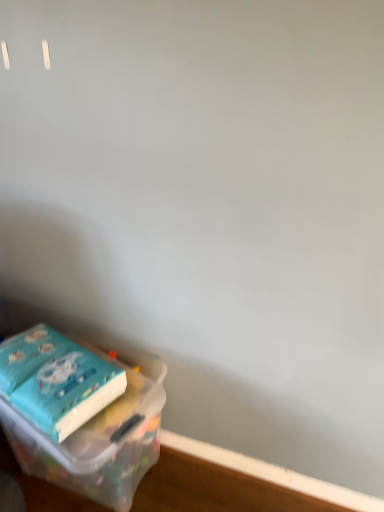
Question: Considering their positions, is translucent plastic container at lower left located in front of or behind teal matte paper at lower left?

Choices:
 (A) behind
 (B) front

Answer: (B)

Question: From a real-world perspective, is translucent plastic container at lower left physically located above or below teal matte paper at lower left?

Choices:
 (A) below
 (B) above

Answer: (A)

Question: Estimate the real-world distances between objects in this image. Which object is closer to the wooden at lower left?

Choices:
 (A) teal matte paper at lower left
 (B) translucent plastic container at lower left

Answer: (B)

Question: Estimate the real-world distances between objects in this image. Which object is farther from the teal matte paper at lower left?

Choices:
 (A) wooden at lower left
 (B) translucent plastic container at lower left

Answer: (A)